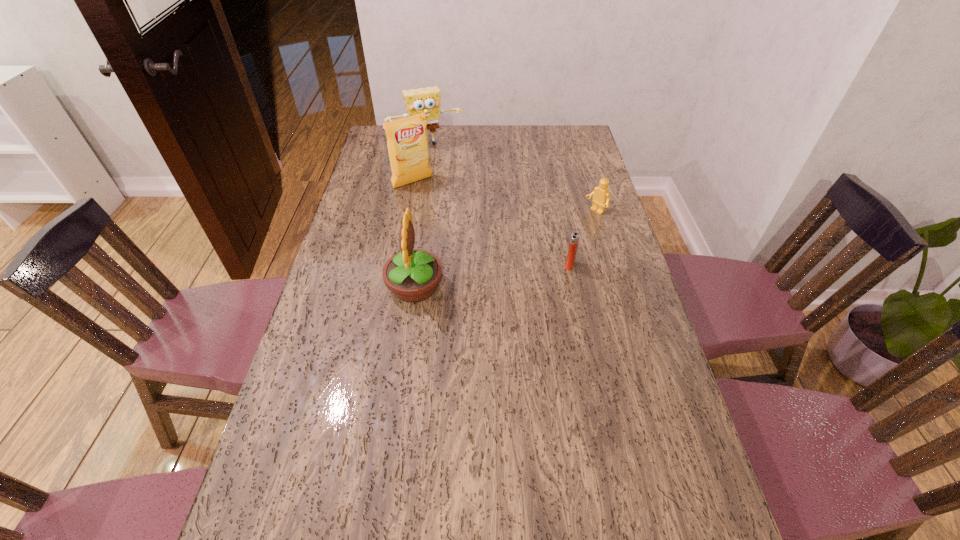
This screenshot has width=960, height=540. What are the coordinates of `crisp (potato chip) located in the left edge section of the desktop` in the screenshot? It's located at (407, 141).

Find the location of a particular element. igniter situated at the right edge is located at coordinates (574, 240).

I want to click on Lego present at the right edge, so pos(601,196).

Locate an element on the screen. Image resolution: width=960 pixels, height=540 pixels. object that is at the far left corner is located at coordinates (420, 100).

In the image, there is a desktop. Find the location of `vacant space at the far edge`. vacant space at the far edge is located at coordinates (481, 147).

Locate an element on the screen. The height and width of the screenshot is (540, 960). free space at the near edge is located at coordinates (372, 495).

Locate an element on the screen. free space at the right edge of the desktop is located at coordinates (568, 207).

Identify the location of free spot between the sunflower and the third nearest object. This screenshot has width=960, height=540. (505, 249).

I want to click on free space between the rightmost object and the igniter, so click(583, 239).

What are the coordinates of `vacant area that lies between the sunflower and the rightmost object` in the screenshot? It's located at (505, 249).